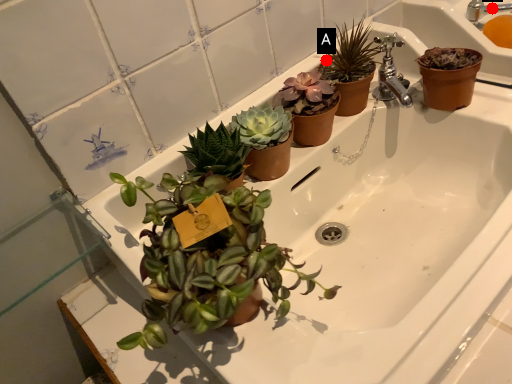
Question: Two points are circled on the image, labeled by A and B beside each circle. Which point is further to the camera?

Choices:
 (A) A is further
 (B) B is further

Answer: (B)